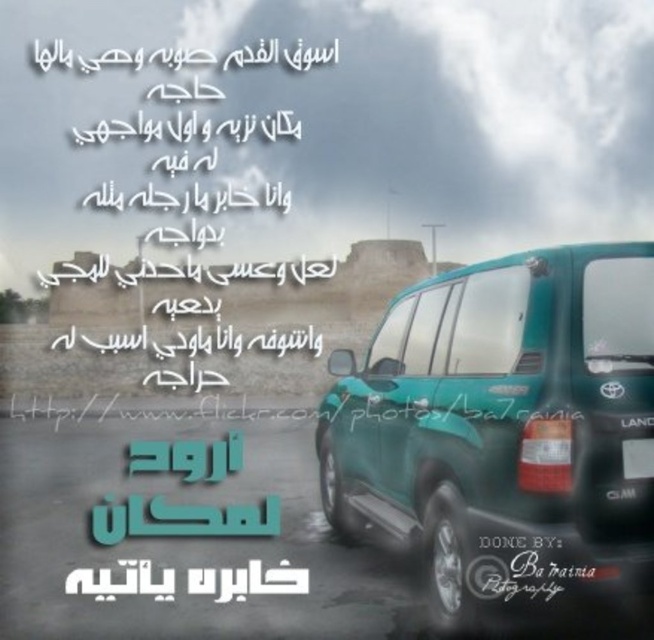
You are a delivery drone that needs to land near the teal glossy suv at center and the green plastic license plate at lower right. The minimum safe distance for landing is 5 feet. Can you safely land between them?

The teal glossy suv at center is 4.58 feet away from the green plastic license plate at lower right. Since the distance is less than the 5 feet minimum safe distance, the drone cannot safely land between them.

You are a photographer planning to take a photo of the teal glossy suv at center. If you want to position your camera exactly at the center of the image, which coordinates would you aim for?

The teal glossy suv at center is located at coordinates point (504, 429), so you should aim your camera at those coordinates to capture it at the center of the image.